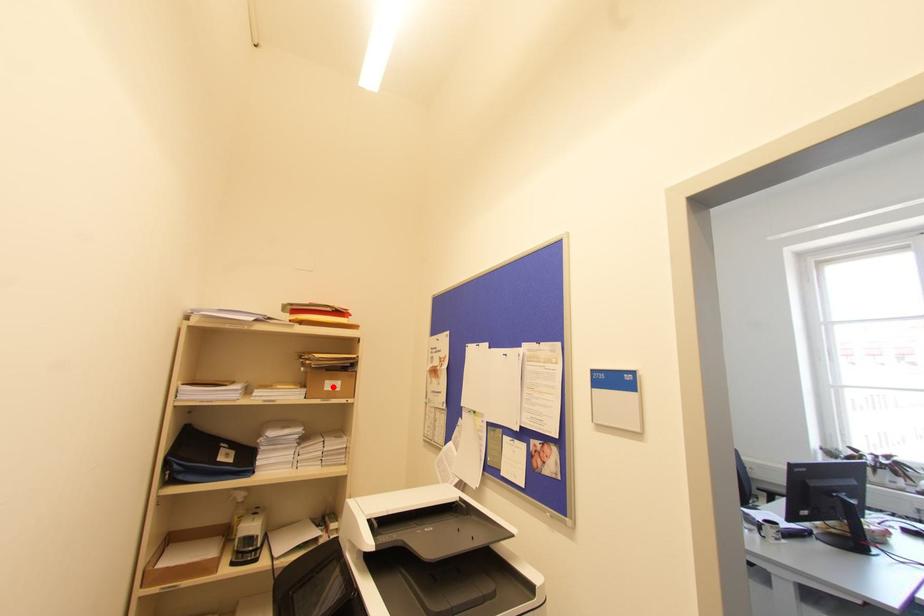
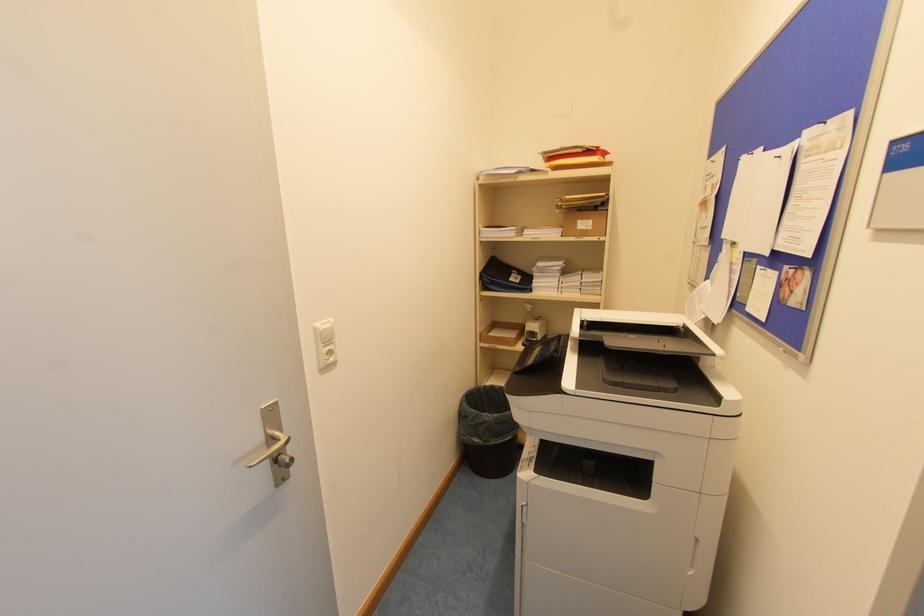
The point at the highlighted location is marked in the first image. Where is the corresponding point in the second image?

(585, 225)